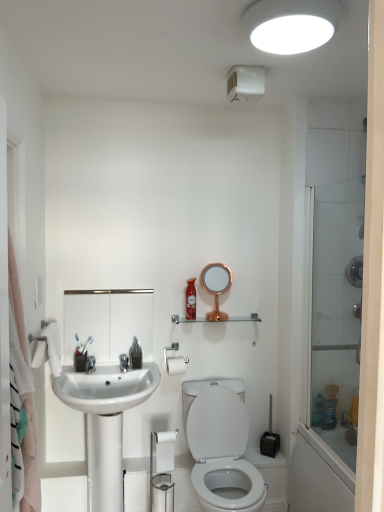
Where is `vacant space situated above white glossy medicine cabinet at upper center (from a real-world perspective)`? The width and height of the screenshot is (384, 512). vacant space situated above white glossy medicine cabinet at upper center (from a real-world perspective) is located at coordinates (x=107, y=290).